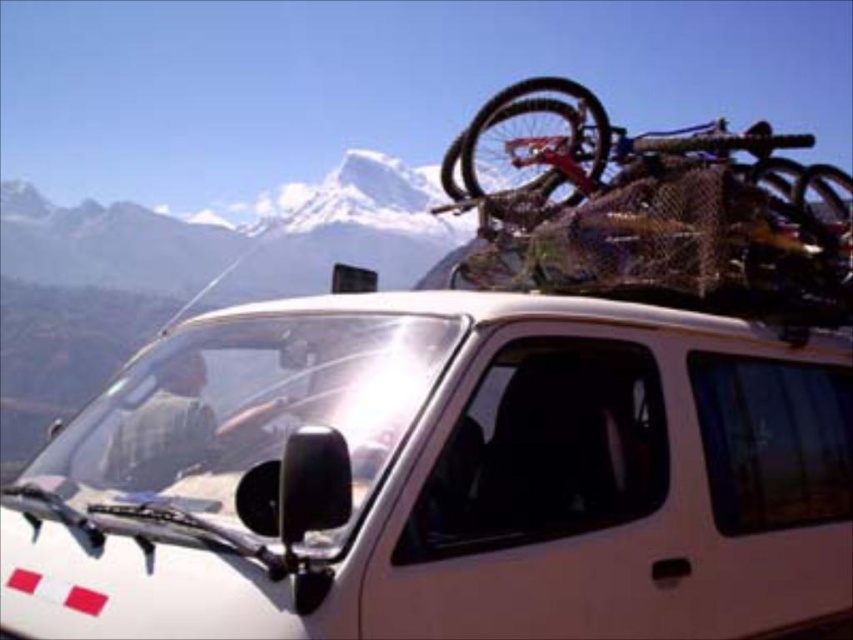
Is white matte van at center bigger than shiny metallic bicycle at top right?

Correct, white matte van at center is larger in size than shiny metallic bicycle at top right.

Is point (202, 422) positioned after point (763, 195)?

No, (202, 422) is closer to viewer.

This screenshot has width=853, height=640. I want to click on white matte van at center, so click(444, 476).

I want to click on white matte van at center, so click(444, 476).